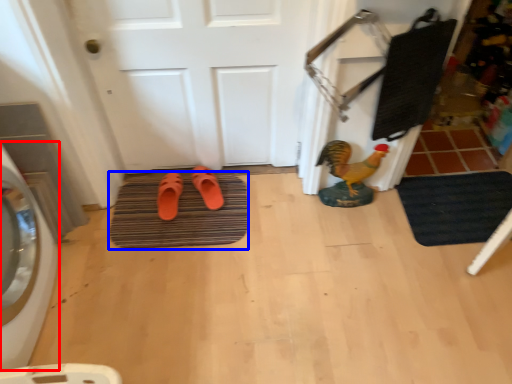
Question: Which point is closer to the camera, washing machine (highlighted by a red box) or bath mat (highlighted by a blue box)?

Choices:
 (A) washing machine
 (B) bath mat

Answer: (A)